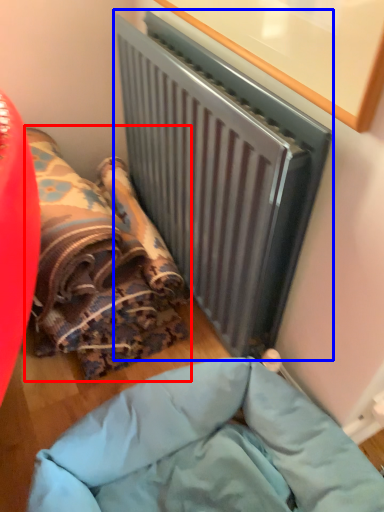
Question: Among these objects, which one is nearest to the camera, bean bag chair (highlighted by a red box) or radiator (highlighted by a blue box)?

Choices:
 (A) bean bag chair
 (B) radiator

Answer: (B)